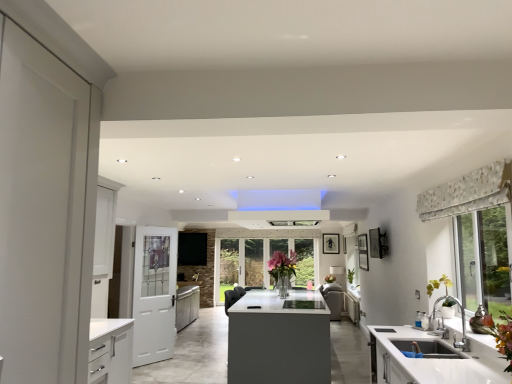
Find the location of a particular element. This screenshot has width=512, height=384. free space above white glossy sink at lower right (from a real-world perspective) is located at coordinates (421, 348).